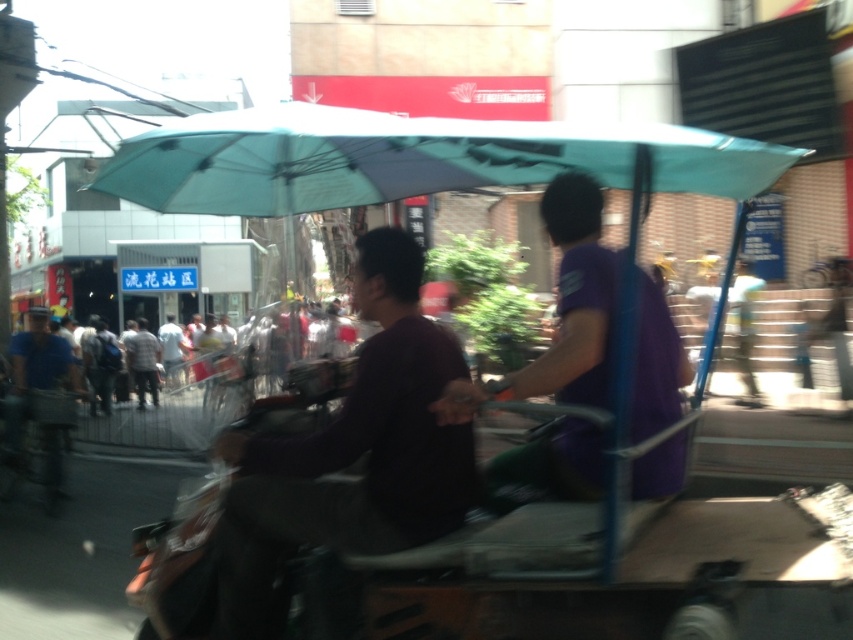
Does point (552, 538) come behind point (410, 340)?

No.

From the picture: Which is more to the right, metallic purple golf cart at center or dark purple shirt at center?

metallic purple golf cart at center is more to the right.

Which is in front, point (271, 481) or point (393, 320)?

Point (271, 481)

This screenshot has height=640, width=853. Identify the location of metallic purple golf cart at center. pos(444,516).

From the picture: Can you confirm if metallic purple golf cart at center is thinner than purple matte shirt at center?

In fact, metallic purple golf cart at center might be wider than purple matte shirt at center.

Is metallic purple golf cart at center further to the viewer compared to purple matte shirt at center?

No, it is not.

Measure the distance between metallic purple golf cart at center and camera.

metallic purple golf cart at center is 6.14 feet away from camera.

Identify the location of metallic purple golf cart at center. The image size is (853, 640). pyautogui.click(x=444, y=516).

Between metallic purple golf cart at center and light gray shirt at center, which one appears on the right side from the viewer's perspective?

Positioned to the right is metallic purple golf cart at center.

Is point (265, 525) positioned in front of point (166, 321)?

Yes.

Find the location of a particular element. The image size is (853, 640). metallic purple golf cart at center is located at coordinates 444,516.